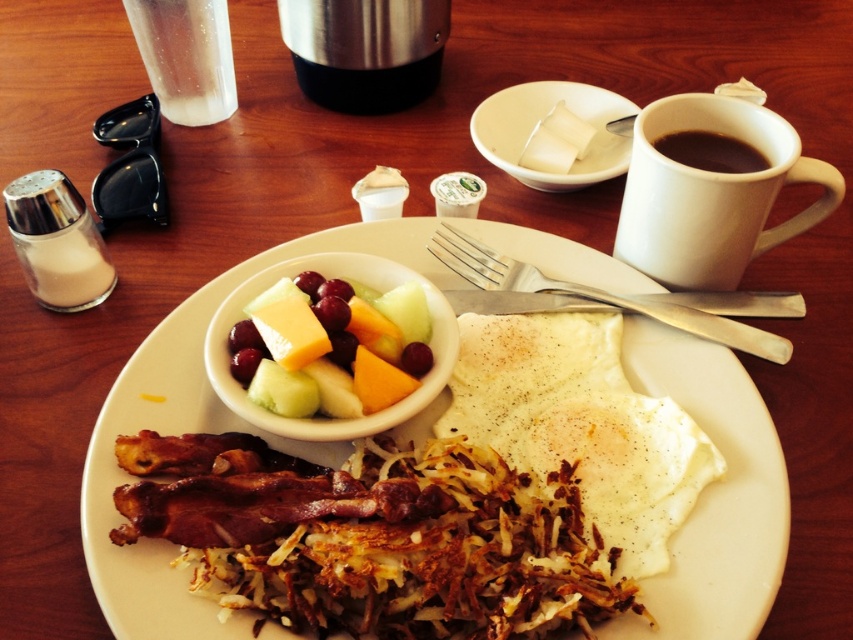
Is slightly crispy bacon at center positioned in front of clear plastic cup at upper left?

Yes, slightly crispy bacon at center is closer to the viewer.

Which is more to the right, slightly crispy bacon at center or clear plastic cup at upper left?

slightly crispy bacon at center is more to the right.

The height and width of the screenshot is (640, 853). Identify the location of slightly crispy bacon at center. (714, 497).

Is point (149, 602) less distant than point (728, 102)?

Yes.

This screenshot has height=640, width=853. In order to click on slightly crispy bacon at center in this screenshot , I will do `click(714, 497)`.

Can you confirm if clear plastic cup at upper left is positioned above black matte cup at upper right?

Indeed, clear plastic cup at upper left is positioned over black matte cup at upper right.

Between clear plastic cup at upper left and black matte cup at upper right, which one has less height?

With less height is black matte cup at upper right.

Find the location of a particular element. Image resolution: width=853 pixels, height=640 pixels. clear plastic cup at upper left is located at coordinates (186, 56).